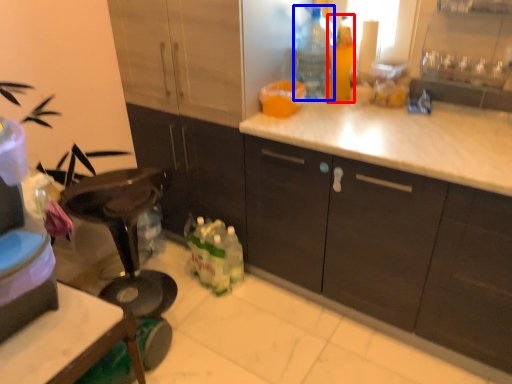
Question: Which object appears closest to the camera in this image, bottle (highlighted by a red box) or bottle (highlighted by a blue box)?

Choices:
 (A) bottle
 (B) bottle

Answer: (A)